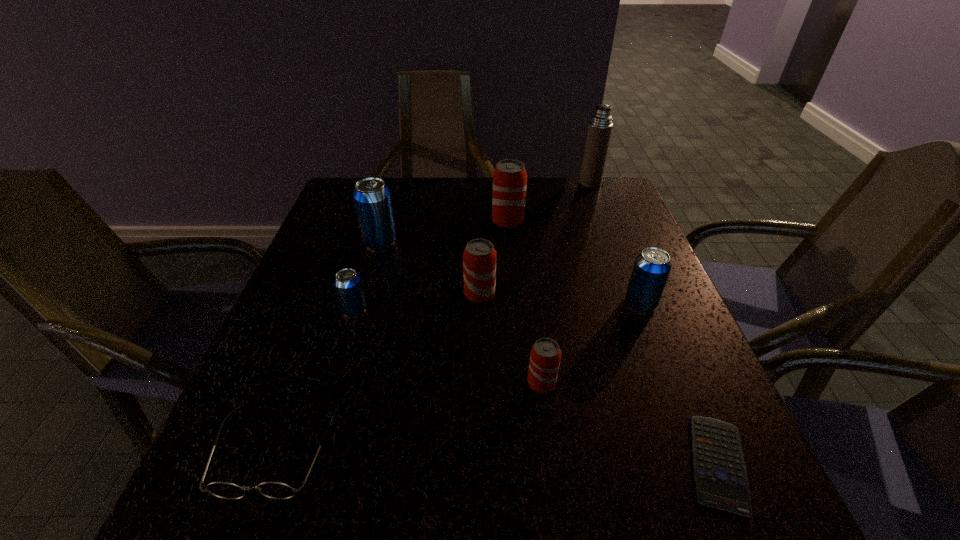
Identify the location of the farthest object. This screenshot has width=960, height=540. (600, 126).

Find the location of `thermos bottle`. thermos bottle is located at coordinates (600, 126).

Find the location of a particular element. This screenshot has height=540, width=960. the biggest orange beer can is located at coordinates (509, 177).

This screenshot has width=960, height=540. In order to click on the farthest beer can in this screenshot , I will do `click(509, 177)`.

Where is `the fifth nearest beer can`? Image resolution: width=960 pixels, height=540 pixels. the fifth nearest beer can is located at coordinates (372, 199).

Locate an element on the screen. The width and height of the screenshot is (960, 540). the seventh nearest object is located at coordinates (372, 199).

This screenshot has height=540, width=960. I want to click on the second farthest orange beer can, so click(x=479, y=258).

Where is `the second smallest blue beer can`? The width and height of the screenshot is (960, 540). the second smallest blue beer can is located at coordinates (651, 269).

I want to click on the rightmost blue beer can, so click(x=651, y=269).

You are a GUI agent. You are given a task and a screenshot of the screen. Output one action in this format:
    pyautogui.click(x=<x>, y=<y>)
    Task: Click on the smallest blue beer can
    The image size is (960, 540).
    Given the screenshot: What is the action you would take?
    pyautogui.click(x=347, y=282)